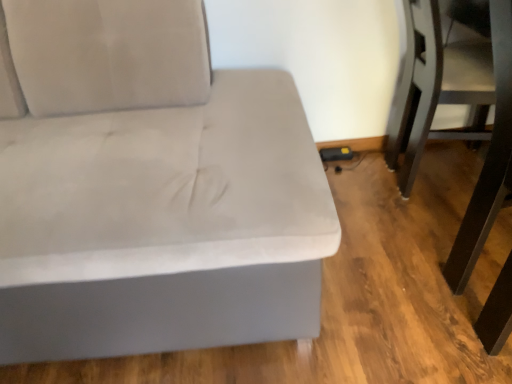
Question: Could you tell me if dark brown wood swivel chair at lower right is turned towards suede-like gray couch at left?

Choices:
 (A) yes
 (B) no

Answer: (B)

Question: Is dark brown wood swivel chair at lower right looking in the opposite direction of suede-like gray couch at left?

Choices:
 (A) no
 (B) yes

Answer: (B)

Question: Can you see dark brown wood swivel chair at lower right touching suede-like gray couch at left?

Choices:
 (A) yes
 (B) no

Answer: (B)

Question: Considering the relative sizes of dark brown wood swivel chair at lower right and suede-like gray couch at left in the image provided, is dark brown wood swivel chair at lower right thinner than suede-like gray couch at left?

Choices:
 (A) no
 (B) yes

Answer: (B)

Question: Does dark brown wood swivel chair at lower right appear on the right side of suede-like gray couch at left?

Choices:
 (A) no
 (B) yes

Answer: (B)

Question: Is the position of dark brown wood swivel chair at lower right less distant than that of suede-like gray couch at left?

Choices:
 (A) no
 (B) yes

Answer: (A)

Question: From the image's perspective, would you say suede-like gray couch at left is positioned over dark brown wood swivel chair at lower right?

Choices:
 (A) no
 (B) yes

Answer: (A)

Question: Considering the relative positions of suede-like gray couch at left and dark brown wood swivel chair at lower right in the image provided, is suede-like gray couch at left to the left of dark brown wood swivel chair at lower right from the viewer's perspective?

Choices:
 (A) no
 (B) yes

Answer: (B)

Question: Is suede-like gray couch at left positioned far away from dark brown wood swivel chair at lower right?

Choices:
 (A) yes
 (B) no

Answer: (B)

Question: Is suede-like gray couch at left completely or partially outside of dark brown wood swivel chair at lower right?

Choices:
 (A) yes
 (B) no

Answer: (A)

Question: Is suede-like gray couch at left smaller than dark brown wood swivel chair at lower right?

Choices:
 (A) no
 (B) yes

Answer: (A)

Question: Can you see suede-like gray couch at left touching dark brown wood swivel chair at lower right?

Choices:
 (A) yes
 (B) no

Answer: (B)

Question: From a real-world perspective, is dark brown wood swivel chair at lower right physically located above or below suede-like gray couch at left?

Choices:
 (A) above
 (B) below

Answer: (B)